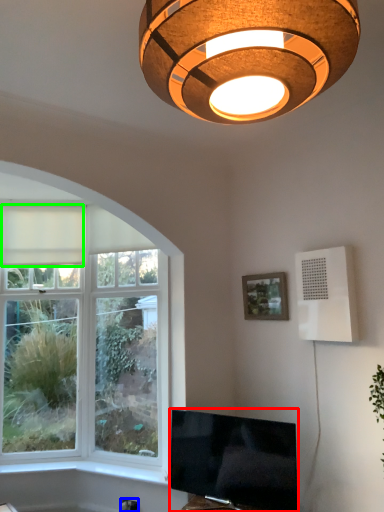
Question: Which object is the closest to the television (highlighted by a red box)? Choose among these: electric outlet (highlighted by a blue box) or curtain (highlighted by a green box).

Choices:
 (A) electric outlet
 (B) curtain

Answer: (A)